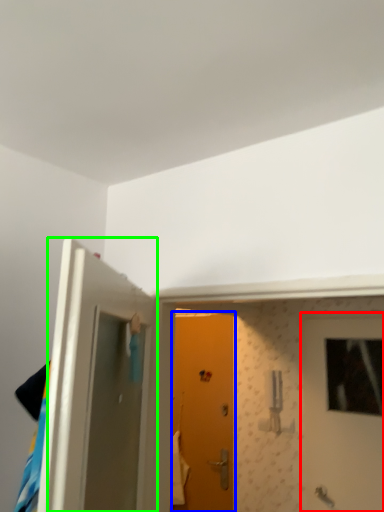
Question: Which is nearer to the door (highlighted by a red box)? door (highlighted by a blue box) or door (highlighted by a green box).

Choices:
 (A) door
 (B) door

Answer: (A)